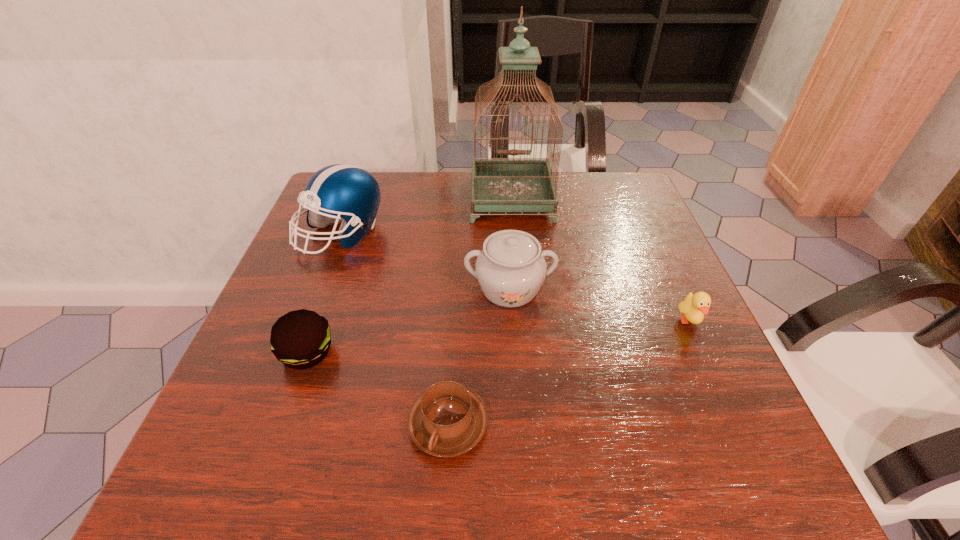
I want to click on the tallest object, so click(502, 184).

You are a GUI agent. You are given a task and a screenshot of the screen. Output one action in this format:
    pyautogui.click(x=<x>, y=<y>)
    Task: Click on the fifth shortest object
    
    Given the screenshot: What is the action you would take?
    pyautogui.click(x=341, y=190)

At what (x,y) coordinates should I click in order to perform the action: click on the third tallest object. Please return your answer as a coordinate pair (x, y). Looking at the image, I should click on (511, 268).

This screenshot has width=960, height=540. Identify the location of patty. (300, 339).

Locate an element on the screen. This screenshot has height=540, width=960. duckling is located at coordinates (693, 307).

Where is `the nearest object`? Image resolution: width=960 pixels, height=540 pixels. the nearest object is located at coordinates (448, 419).

Locate an element on the screen. The image size is (960, 540). the shortest object is located at coordinates (448, 419).

This screenshot has height=540, width=960. I want to click on free point located 0.400m at the door of the birdcage, so click(x=526, y=353).

Where is `vacant space situated 0.070m at the front of the football helmet with the faceguard`? The image size is (960, 540). vacant space situated 0.070m at the front of the football helmet with the faceguard is located at coordinates (323, 285).

The width and height of the screenshot is (960, 540). I want to click on free space located 0.240m on the right of the chinaware, so click(x=668, y=288).